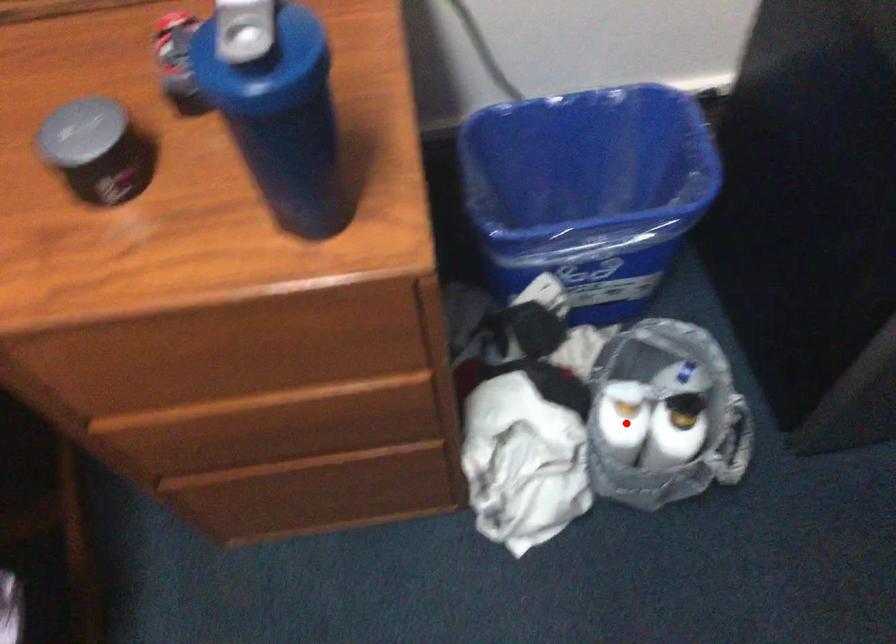
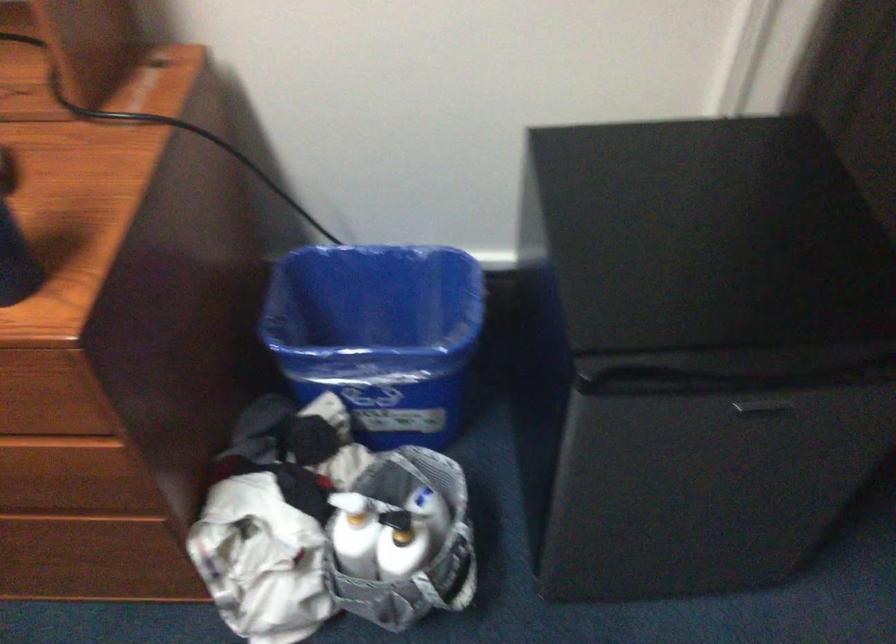
Where in the second image is the point corresponding to the highlighted location from the first image?

(354, 534)